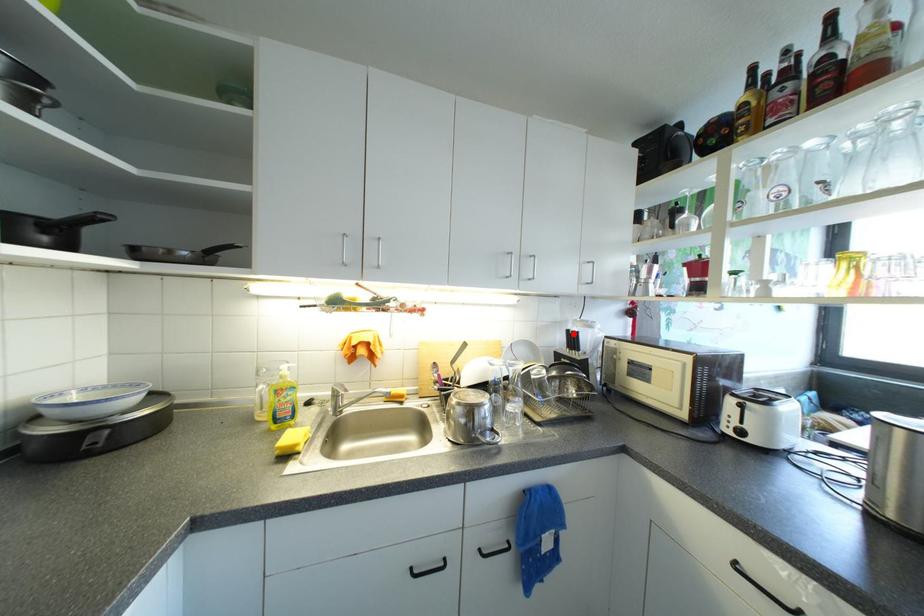
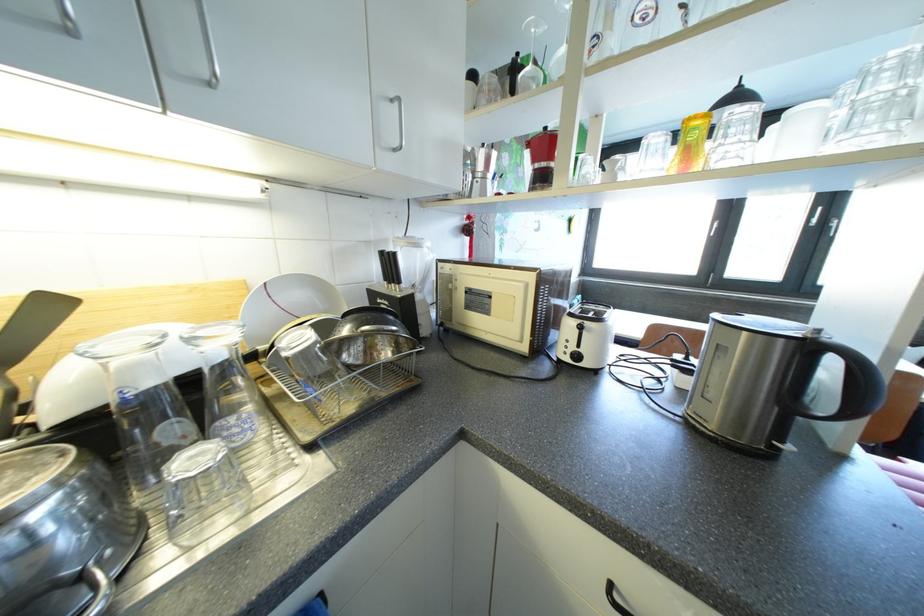
Question: I am providing you with two images of the same scene from different viewpoints. A red point is marked on the first image. Can you still see the location of the red point in image 2?

Choices:
 (A) Yes
 (B) No

Answer: (A)